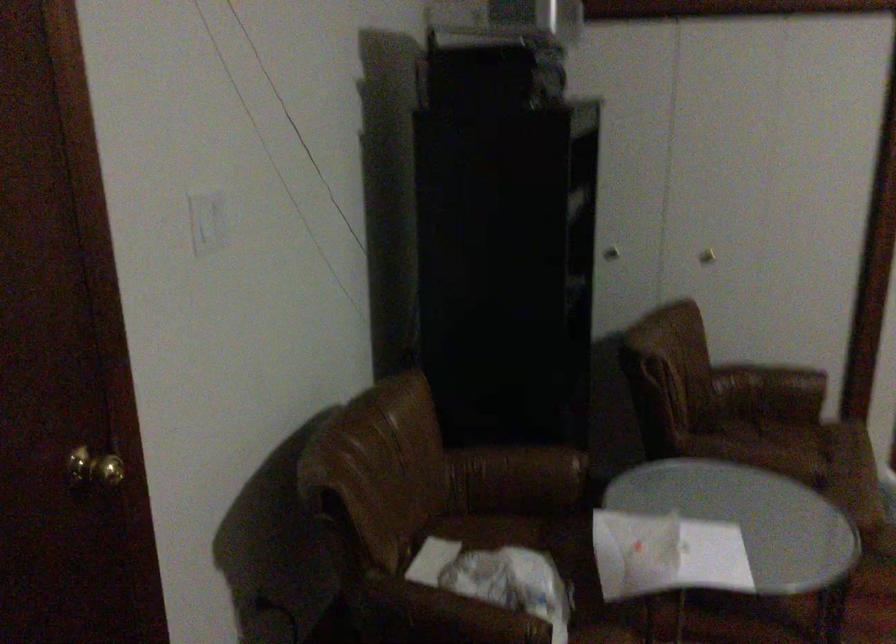
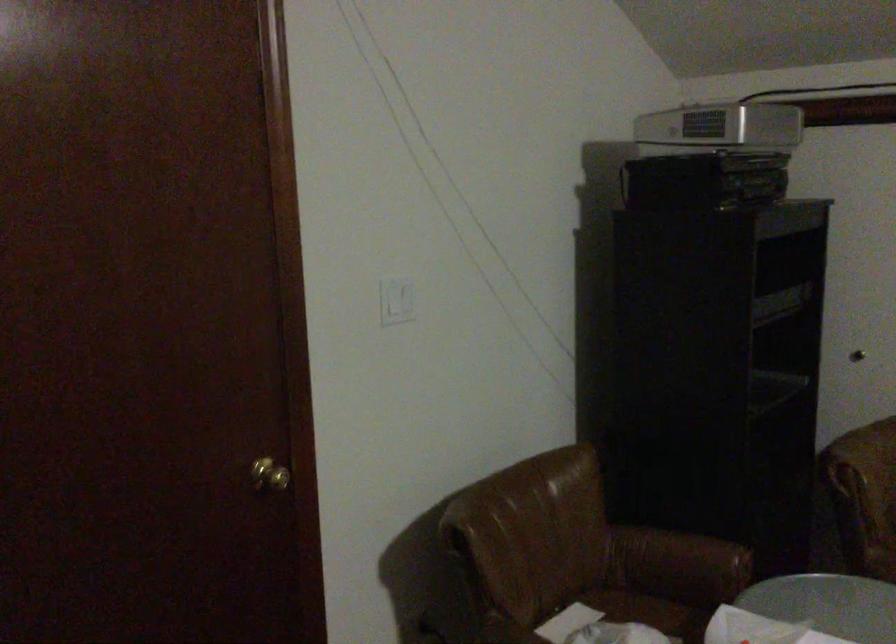
Question: The images are taken continuously from a first-person perspective. In which direction is your viewpoint rotating?

Choices:
 (A) Left
 (B) Right
 (C) Up
 (D) Down

Answer: (A)